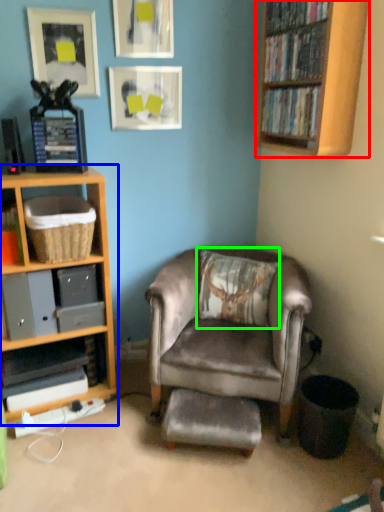
Question: Considering the real-world distances, which object is farthest from bookcase (highlighted by a red box)? shelf (highlighted by a blue box) or pillow (highlighted by a green box)?

Choices:
 (A) shelf
 (B) pillow

Answer: (A)